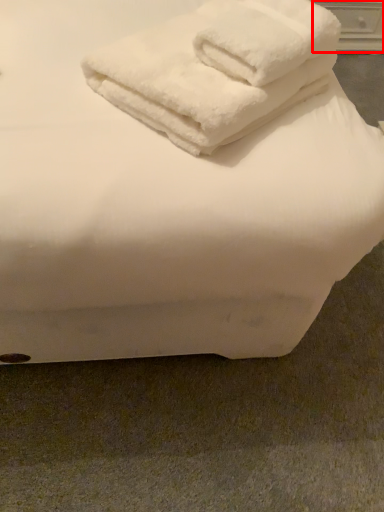
Question: From the image's perspective, what is the correct spatial relationship of drawer (annotated by the red box) in relation to towel?

Choices:
 (A) above
 (B) below

Answer: (A)